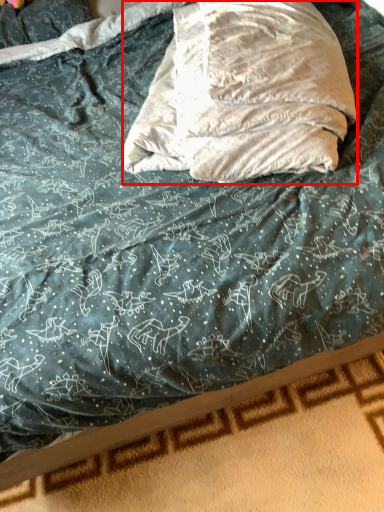
Question: From the image's perspective, what is the correct spatial relationship of throw pillow (annotated by the red box) in relation to bed frame?

Choices:
 (A) above
 (B) below

Answer: (A)